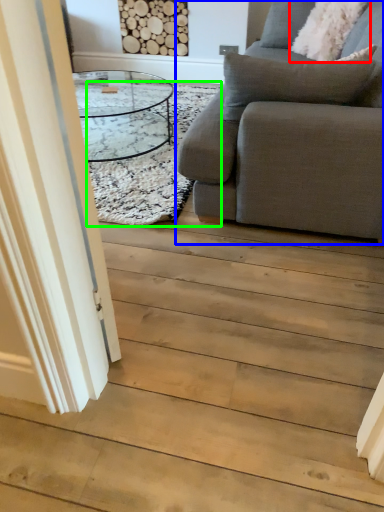
Question: Estimate the real-world distances between objects in this image. Which object is farther from pillow (highlighted by a red box), studio couch (highlighted by a blue box) or mat (highlighted by a green box)?

Choices:
 (A) studio couch
 (B) mat

Answer: (A)